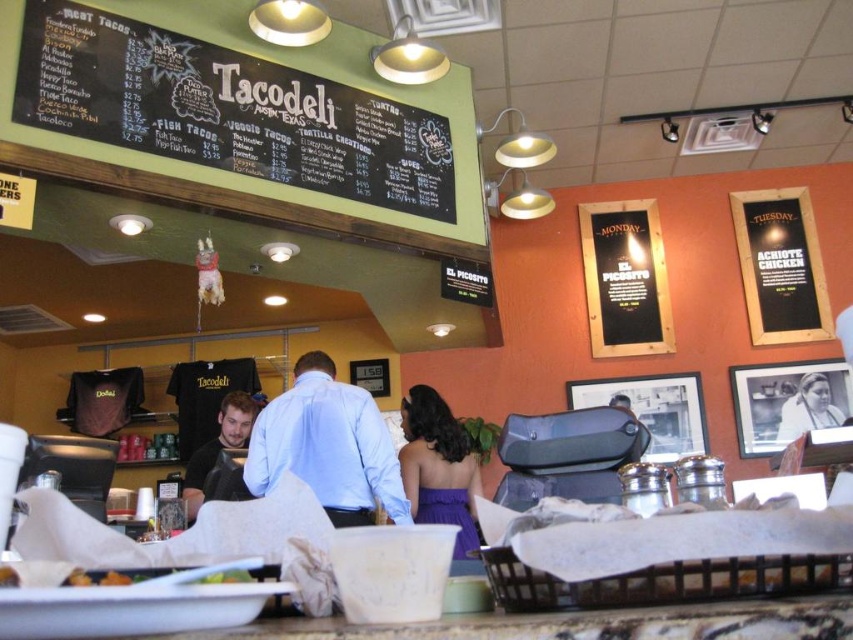
Can you confirm if black chalkboard menu at upper center is positioned above light blue shirt at center?

Yes, black chalkboard menu at upper center is above light blue shirt at center.

Between point (22, 88) and point (299, 387), which one is positioned behind?

Positioned behind is point (22, 88).

Image resolution: width=853 pixels, height=640 pixels. I want to click on black chalkboard menu at upper center, so click(x=238, y=108).

Is light blue shirt at center above purple satin dress at center?

Yes, light blue shirt at center is above purple satin dress at center.

Does light blue shirt at center have a larger size compared to purple satin dress at center?

No, light blue shirt at center is not bigger than purple satin dress at center.

Does point (277, 461) come in front of point (451, 417)?

That is True.

This screenshot has height=640, width=853. Identify the location of light blue shirt at center. (328, 445).

Does black chalkboard menu at upper center have a larger size compared to white glossy photo frame at upper right?

Yes, black chalkboard menu at upper center is bigger than white glossy photo frame at upper right.

Which is behind, point (148, 38) or point (798, 429)?

Point (798, 429)

Where is `black chalkboard menu at upper center`? black chalkboard menu at upper center is located at coordinates (238, 108).